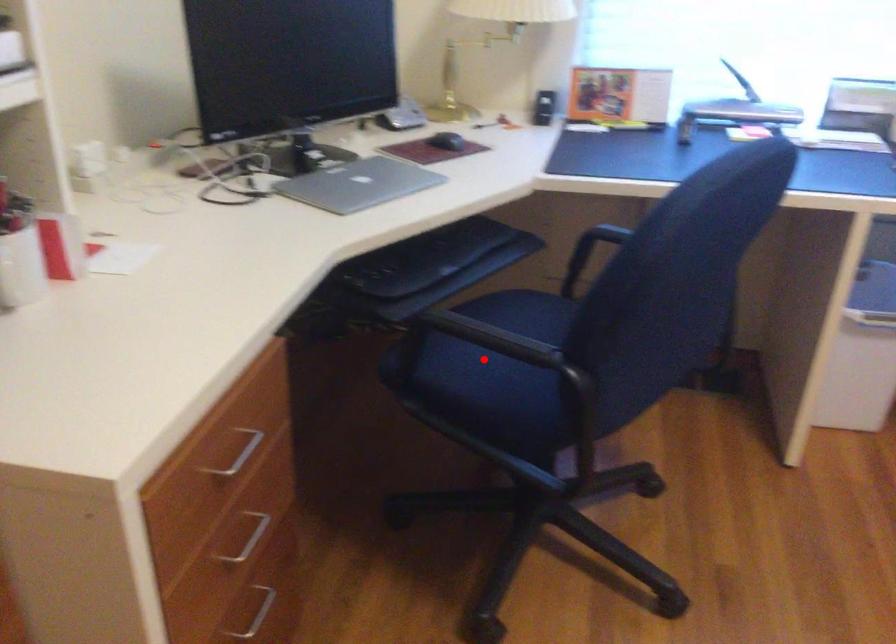
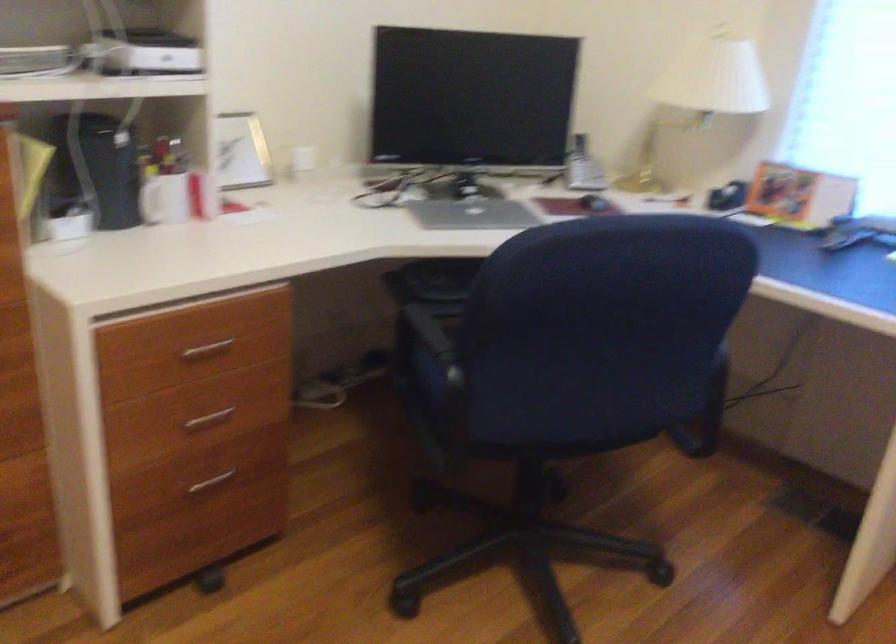
Question: I am providing you with two images of the same scene from different viewpoints. A red point is marked on the first image. Is the red point's position out of view in image 2?

Choices:
 (A) Yes
 (B) No

Answer: (A)